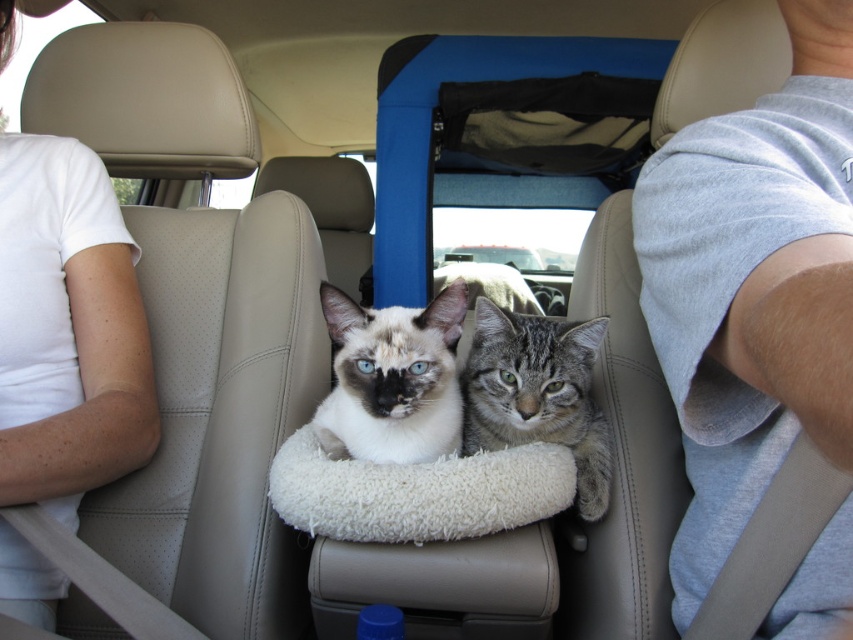
Question: Can you confirm if white cotton shirt at upper left is positioned to the left of white fluffy cat bed at center?

Choices:
 (A) yes
 (B) no

Answer: (A)

Question: Which object is farther from the camera taking this photo?

Choices:
 (A) white fur cat at center
 (B) gray cotton shirt at upper right
 (C) white cotton shirt at upper left
 (D) gray tabby cat at center

Answer: (C)

Question: Which point is closer to the camera taking this photo?

Choices:
 (A) coord(91,260)
 (B) coord(349,477)

Answer: (B)

Question: Which point is farther to the camera?

Choices:
 (A) white cotton shirt at upper left
 (B) gray tabby cat at center
 (C) gray cotton shirt at upper right

Answer: (A)

Question: Can you confirm if white fur cat at center is wider than gray tabby cat at center?

Choices:
 (A) no
 (B) yes

Answer: (A)

Question: Can you confirm if white fluffy cat bed at center is positioned above gray tabby cat at center?

Choices:
 (A) no
 (B) yes

Answer: (A)